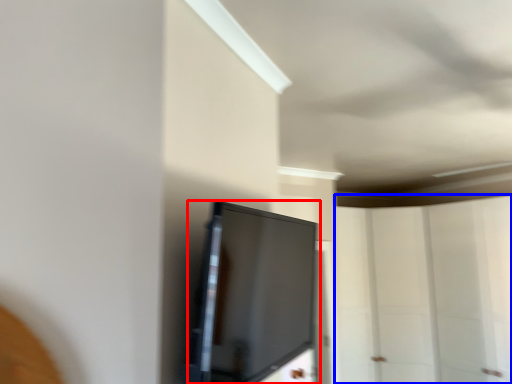
Question: Which point is closer to the camera, screen (highlighted by a red box) or glass door (highlighted by a blue box)?

Choices:
 (A) screen
 (B) glass door

Answer: (A)